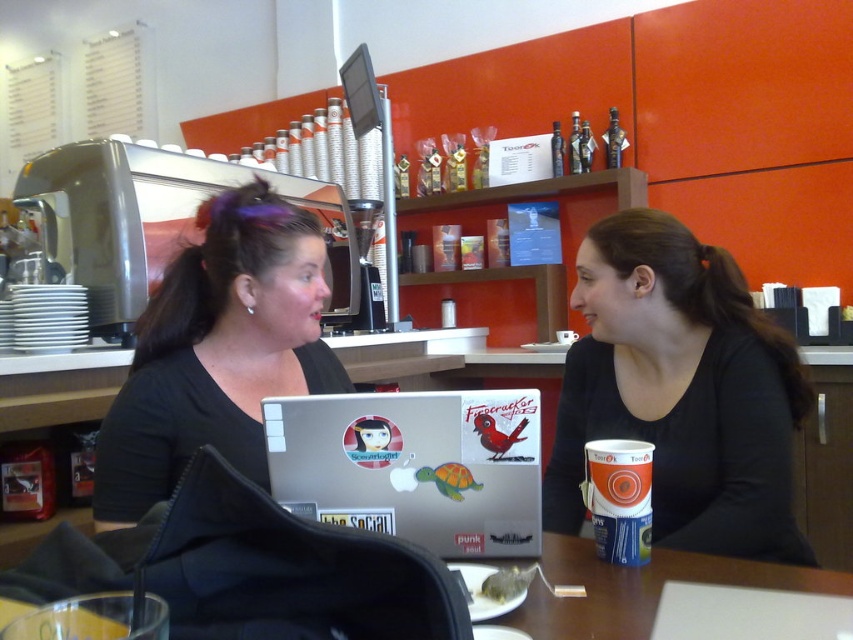
You are standing 5 feet away from the table in the image. There is a point at coordinates point [583,432]. Can you reach that point without moving closer to the table?

The distance of point [583,432] from viewer is 4.58 feet, so yes, you can reach that point without moving closer since you are already 5 feet away, which is slightly farther than the point.

You are a delivery person who needs to place a small package between the black matte shirt at center and the brown wooden table at lower center. The package is 12 inches long. Can you fit it between them without moving either object?

The distance between the black matte shirt at center and the brown wooden table at lower center is 11.29 inches. Since the package is 12 inches long, it cannot fit between them without moving either object.

You are a customer at the coffee shop and want to place your orange matte cup at center on the table without moving the matte black laptop at center. Is this possible? Please explain based on their positions.

The matte black laptop at center is closer to you than the orange matte cup at center, so you can place the orange matte cup at center behind the laptop without moving it.